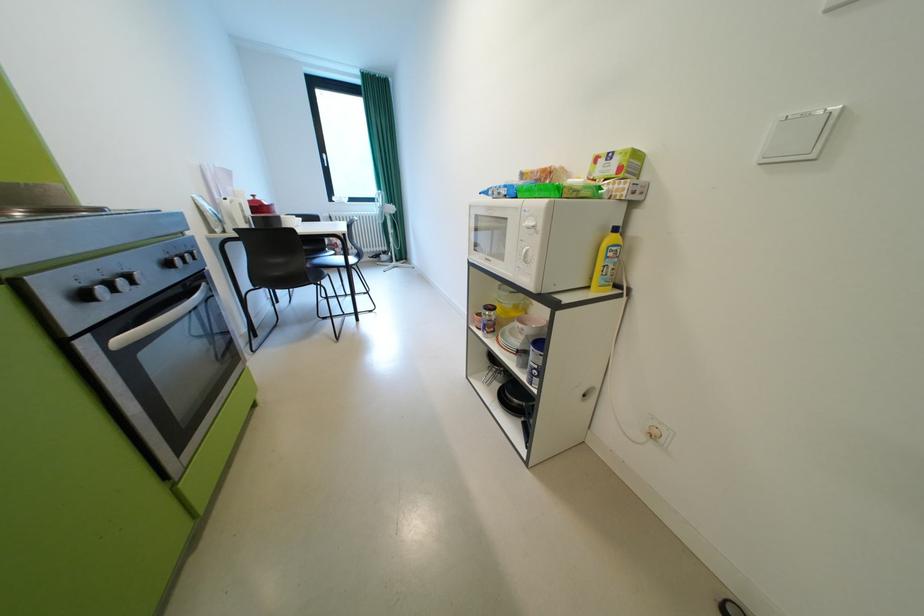
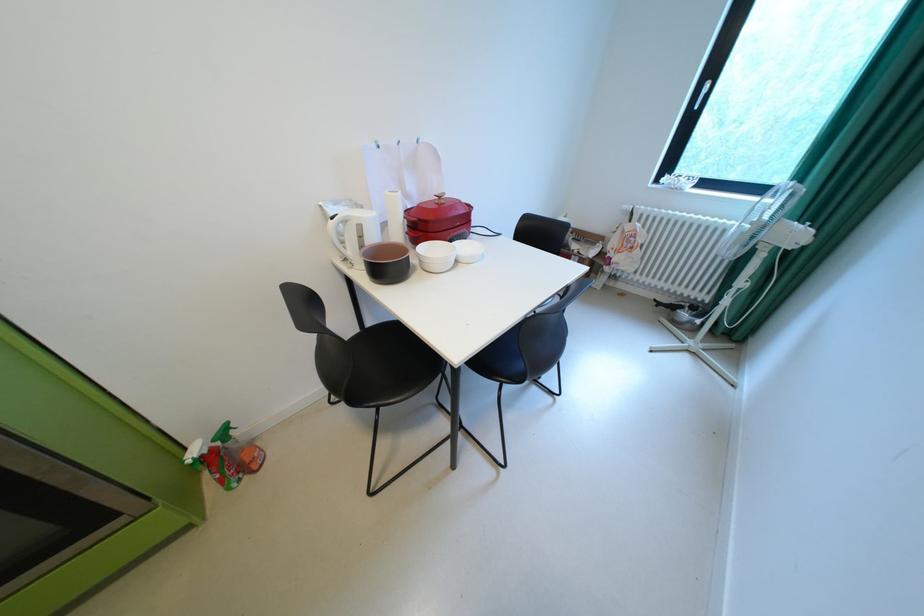
The point at [251,206] is marked in the first image. Where is the corresponding point in the second image?

(370, 227)